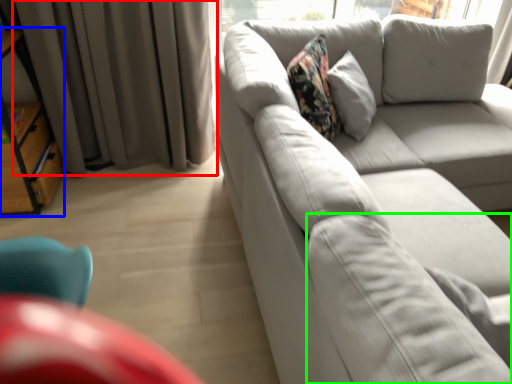
Question: Considering the real-world distances, which object is farthest from curtain (highlighted by a red box)? bookshelf (highlighted by a blue box) or pillow (highlighted by a green box)?

Choices:
 (A) bookshelf
 (B) pillow

Answer: (B)